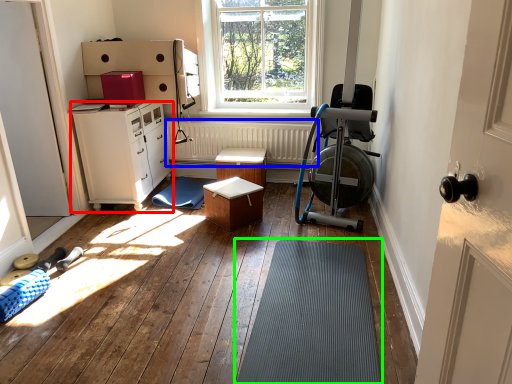
Question: Which is nearer to the chest of drawers (highlighted by a red box)? radiator (highlighted by a blue box) or bath mat (highlighted by a green box).

Choices:
 (A) radiator
 (B) bath mat

Answer: (A)